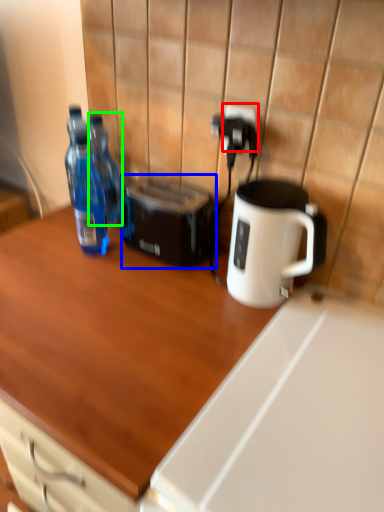
Question: Which is farther away from electric outlet (highlighted by a red box)? toaster (highlighted by a blue box) or bottle (highlighted by a green box)?

Choices:
 (A) toaster
 (B) bottle

Answer: (B)